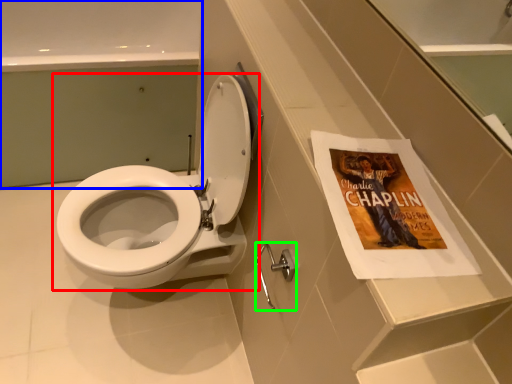
Question: Considering the real-world distances, which object is farthest from toilet (highlighted by a red box)? bath (highlighted by a blue box) or towel bar (highlighted by a green box)?

Choices:
 (A) bath
 (B) towel bar

Answer: (A)